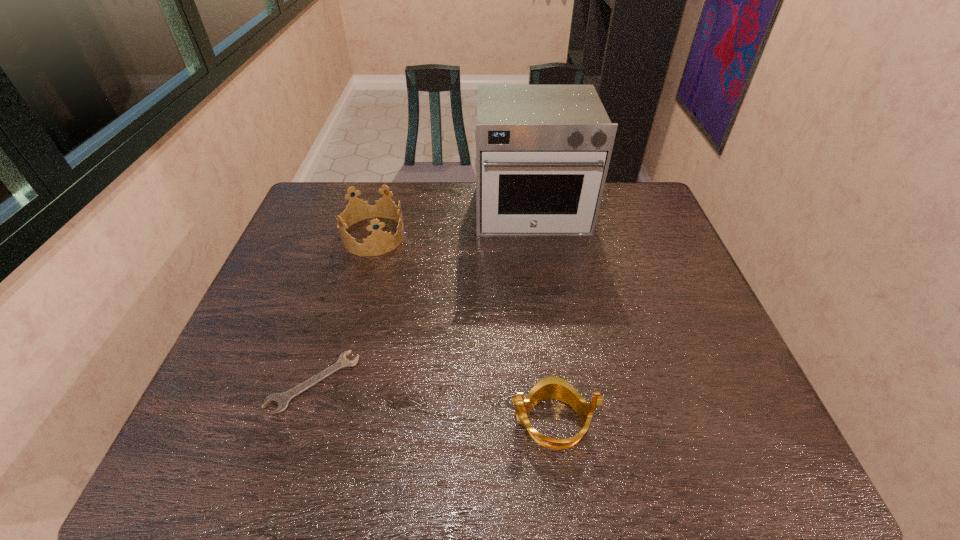
At what (x,y) coordinates should I click in order to perform the action: click on free space at the left edge. Please return your answer as a coordinate pair (x, y). Looking at the image, I should click on (255, 422).

Where is `vacant point at the right edge`? vacant point at the right edge is located at coordinates (689, 312).

Identify the location of blank area at the near left corner. (213, 453).

In the image, there is a desktop. At what (x,y) coordinates should I click in order to perform the action: click on vacant space at the far right corner. Please return your answer as a coordinate pair (x, y). This screenshot has height=540, width=960. Looking at the image, I should click on (608, 200).

Find the location of a particular element. The image size is (960, 540). blank space at the near right corner is located at coordinates (701, 449).

Image resolution: width=960 pixels, height=540 pixels. I want to click on empty location between the left tiara and the tallest object, so click(452, 223).

Find the location of a particular element. vacant space that's between the wrench and the toaster oven is located at coordinates (422, 296).

Image resolution: width=960 pixels, height=540 pixels. I want to click on unoccupied position between the right tiara and the tallest object, so click(x=541, y=316).

Where is `unoccupied position between the wrench and the third shortest object`? unoccupied position between the wrench and the third shortest object is located at coordinates (344, 309).

Locate an element on the screen. The width and height of the screenshot is (960, 540). vacant area that lies between the toaster oven and the nearer tiara is located at coordinates (541, 316).